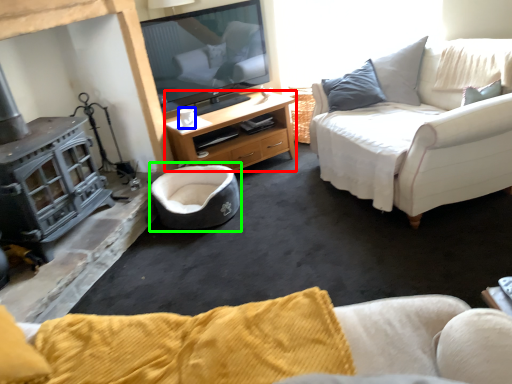
Question: Which object is positioned closest to desk (highlighted by a red box)? Select from coffee cup (highlighted by a blue box) and bean bag chair (highlighted by a green box).

Choices:
 (A) coffee cup
 (B) bean bag chair

Answer: (B)